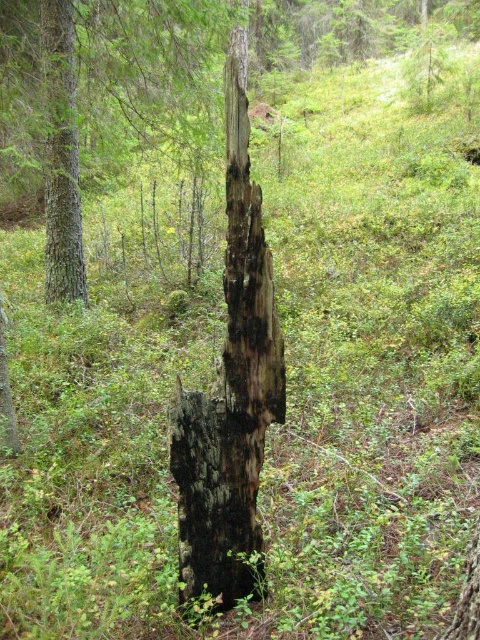
Question: From the image, what is the correct spatial relationship of charred wood stump at center in relation to charcoal wood stump at center?

Choices:
 (A) left
 (B) right

Answer: (A)

Question: Which object appears farthest from the camera in this image?

Choices:
 (A) charcoal wood stump at center
 (B) charred wood stump at center

Answer: (B)

Question: Which of these objects is positioned farthest from the charcoal wood stump at center?

Choices:
 (A) charred wood stump at center
 (B) smooth brown tree trunk at left

Answer: (A)

Question: Considering the real-world distances, which object is farthest from the charred wood stump at center?

Choices:
 (A) smooth brown tree trunk at left
 (B) charcoal wood stump at center

Answer: (B)

Question: Is charred wood stump at center wider than charcoal wood stump at center?

Choices:
 (A) yes
 (B) no

Answer: (A)

Question: Can you confirm if charcoal wood stump at center is positioned above smooth brown tree trunk at left?

Choices:
 (A) no
 (B) yes

Answer: (A)